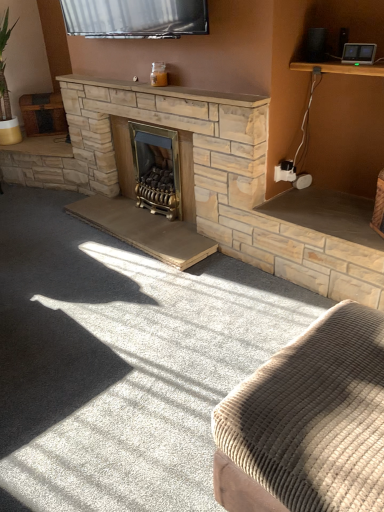
At what (x,y) coordinates should I click in order to perform the action: click on free point above corduroy fabric ottoman at lower right (from a real-world perspective). Please return your answer as a coordinate pair (x, y). The height and width of the screenshot is (512, 384). Looking at the image, I should click on (341, 386).